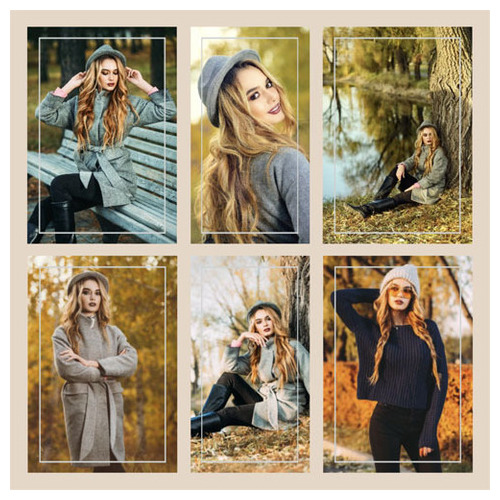
Locate an element on the screen. The height and width of the screenshot is (500, 500). picture in collage is located at coordinates pos(96,183), pos(254,177), pos(403,181), pos(139,321), pos(245,292), pos(371,316).